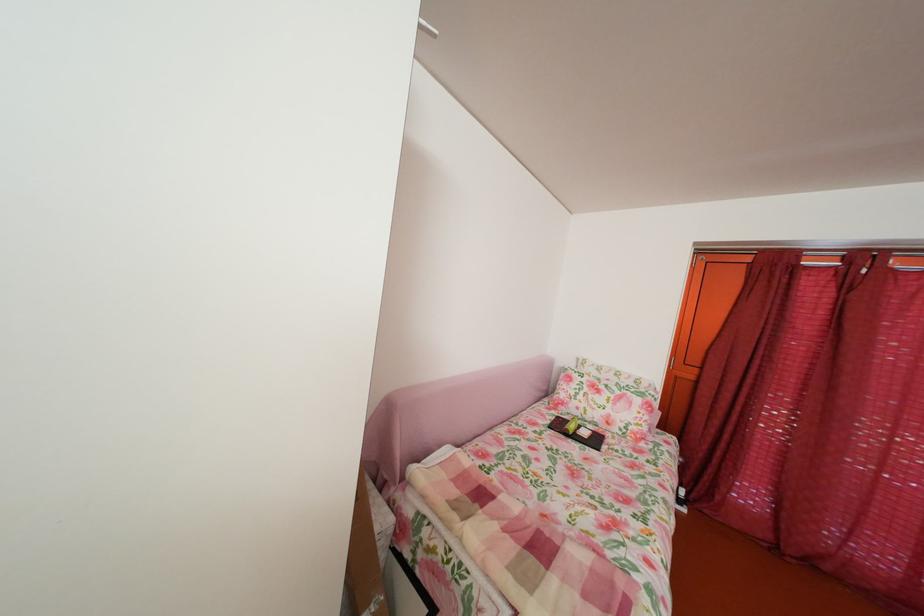
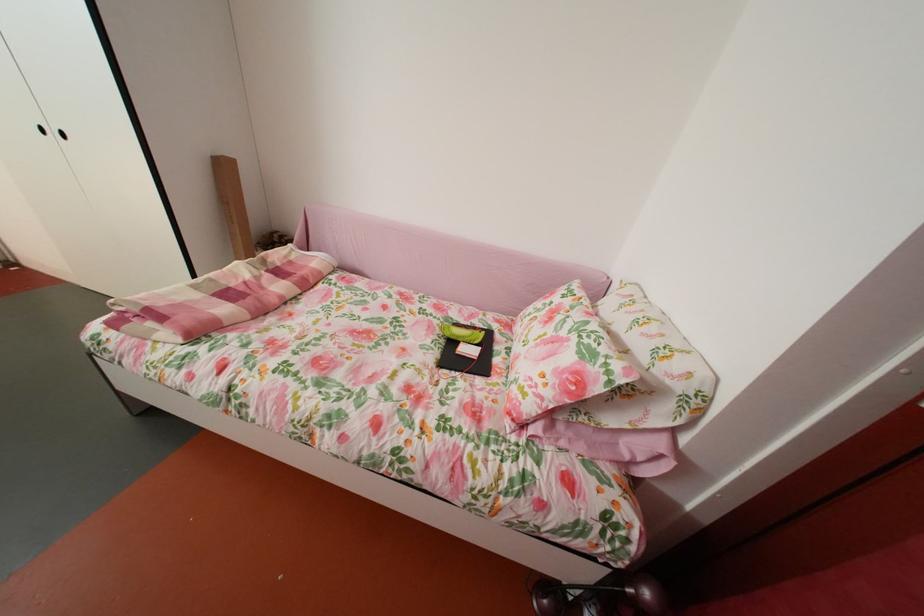
Locate, in the second image, the point that corresponds to point (657, 435) in the first image.

(541, 413)